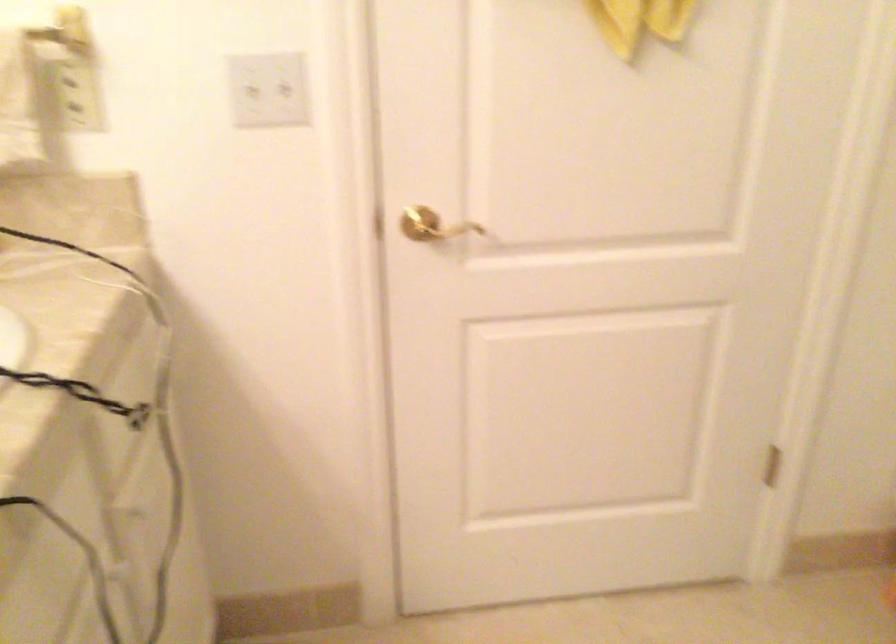
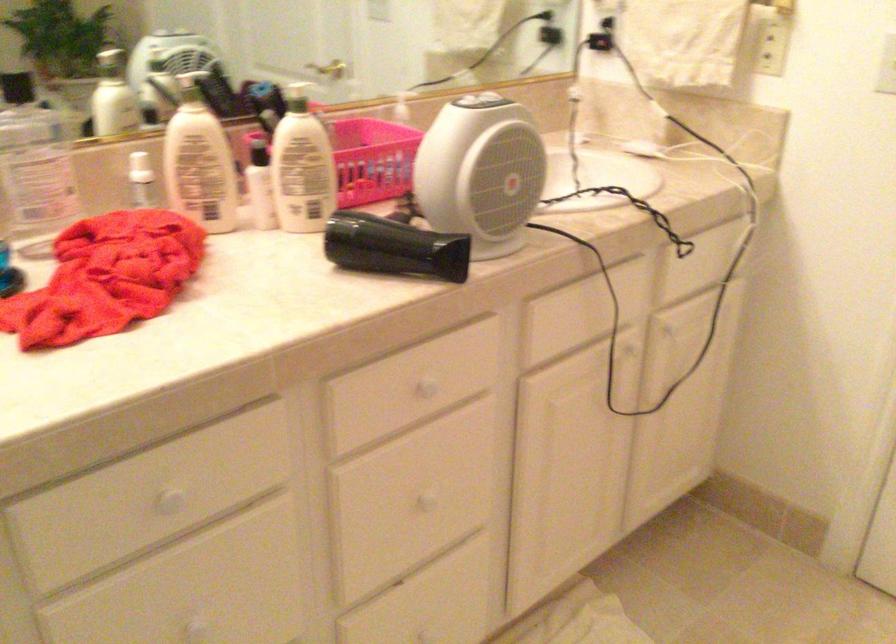
In the second image, find the point that corresponds to point 117,562 in the first image.

(625, 348)